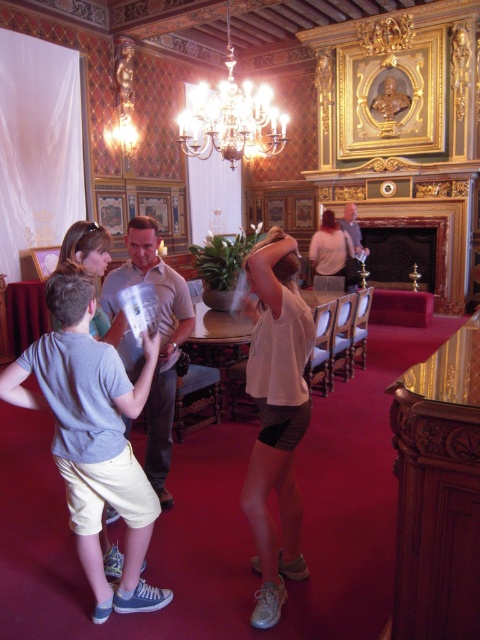
You are standing in the grand room and want to move from point A to point B. Point A is at coordinate [261,532] and point B is at coordinate [127,342]. Which point is closer to you when you start at point A?

Point A at coordinate [261,532] is closer to you because it is your starting position, while point B at coordinate [127,342] is further away.